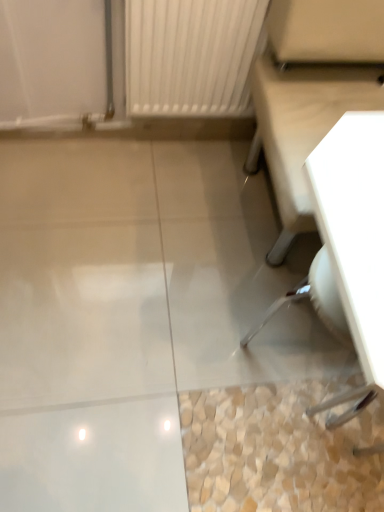
Question: Based on their sizes in the image, would you say white glossy table at upper right is bigger or smaller than clear plastic swivel chair at lower right?

Choices:
 (A) big
 (B) small

Answer: (A)

Question: In the image, is white glossy table at upper right on the left side or the right side of clear plastic swivel chair at lower right?

Choices:
 (A) left
 (B) right

Answer: (B)

Question: From the image's perspective, is white glossy table at upper right positioned above or below clear plastic swivel chair at lower right?

Choices:
 (A) below
 (B) above

Answer: (B)

Question: In terms of size, does clear plastic swivel chair at lower right appear bigger or smaller than white glossy table at upper right?

Choices:
 (A) big
 (B) small

Answer: (B)

Question: Is clear plastic swivel chair at lower right in front of or behind white glossy table at upper right in the image?

Choices:
 (A) behind
 (B) front

Answer: (A)

Question: From the image's perspective, is clear plastic swivel chair at lower right positioned above or below white glossy table at upper right?

Choices:
 (A) above
 (B) below

Answer: (B)

Question: Is point (337, 306) closer or farther from the camera than point (271, 148)?

Choices:
 (A) farther
 (B) closer

Answer: (B)